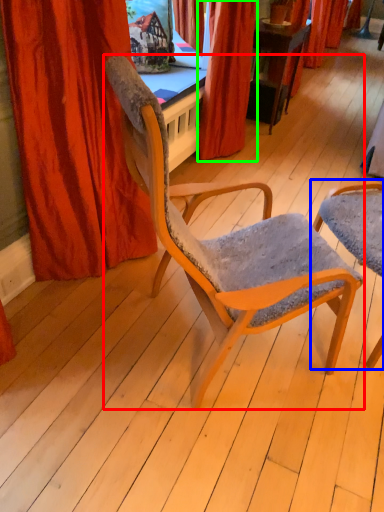
Question: Which is farther away from chair (highlighted by a red box)? chair (highlighted by a blue box) or curtain (highlighted by a green box)?

Choices:
 (A) chair
 (B) curtain

Answer: (B)